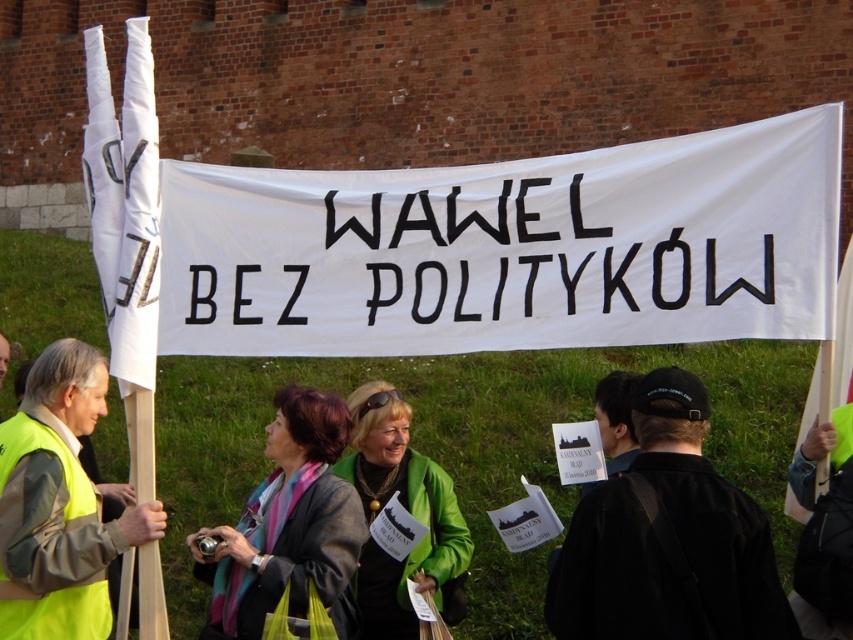
Is point (608, 513) more distant than point (312, 417)?

No, it is not.

The height and width of the screenshot is (640, 853). In order to click on black fabric cap at upper center in this screenshot , I will do `click(666, 540)`.

The image size is (853, 640). Find the location of `black fabric cap at upper center`. black fabric cap at upper center is located at coordinates (666, 540).

Based on the photo, is white paper banner at center wider than black fabric cap at upper center?

Yes.

Does white paper banner at center have a larger size compared to black fabric cap at upper center?

Yes, white paper banner at center is bigger than black fabric cap at upper center.

Find the location of `white paper banner at center`. white paper banner at center is located at coordinates (509, 248).

This screenshot has width=853, height=640. Describe the element at coordinates (509, 248) in the screenshot. I see `white paper banner at center` at that location.

Between white paper banner at center and gray woolen jacket at center, which one is positioned lower?

gray woolen jacket at center is lower down.

Who is more distant from viewer, (346, 308) or (242, 564)?

The point (346, 308) is more distant.

You are a GUI agent. You are given a task and a screenshot of the screen. Output one action in this format:
    pyautogui.click(x=<x>, y=<y>)
    Task: Click on the white paper banner at center
    
    Given the screenshot: What is the action you would take?
    pyautogui.click(x=509, y=248)